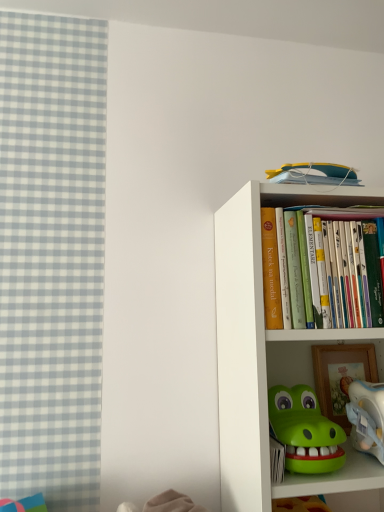
Question: Does white matte bookcase at right have a greater height compared to plastic white toy at lower right?

Choices:
 (A) no
 (B) yes

Answer: (B)

Question: Considering the relative sizes of white matte bookcase at right and plastic white toy at lower right in the image provided, is white matte bookcase at right bigger than plastic white toy at lower right?

Choices:
 (A) no
 (B) yes

Answer: (B)

Question: From the image's perspective, is white matte bookcase at right beneath plastic white toy at lower right?

Choices:
 (A) no
 (B) yes

Answer: (A)

Question: Is white matte bookcase at right facing towards plastic white toy at lower right?

Choices:
 (A) no
 (B) yes

Answer: (B)

Question: Is white matte bookcase at right outside of plastic white toy at lower right?

Choices:
 (A) yes
 (B) no

Answer: (A)

Question: Is plastic white toy at lower right a part of white matte bookcase at right?

Choices:
 (A) yes
 (B) no

Answer: (A)

Question: Can you confirm if plastic white toy at lower right is positioned to the left of white matte bookcase at right?

Choices:
 (A) no
 (B) yes

Answer: (A)

Question: From the image's perspective, is plastic white toy at lower right located above white matte bookcase at right?

Choices:
 (A) no
 (B) yes

Answer: (A)

Question: Does plastic white toy at lower right have a smaller size compared to white matte bookcase at right?

Choices:
 (A) yes
 (B) no

Answer: (A)

Question: Would you consider plastic white toy at lower right to be distant from white matte bookcase at right?

Choices:
 (A) no
 (B) yes

Answer: (A)

Question: Is plastic white toy at lower right positioned beyond the bounds of white matte bookcase at right?

Choices:
 (A) yes
 (B) no

Answer: (B)

Question: Is plastic white toy at lower right thinner than white matte bookcase at right?

Choices:
 (A) no
 (B) yes

Answer: (B)

Question: Is plastic white toy at lower right in front of or behind white matte bookcase at right in the image?

Choices:
 (A) front
 (B) behind

Answer: (B)